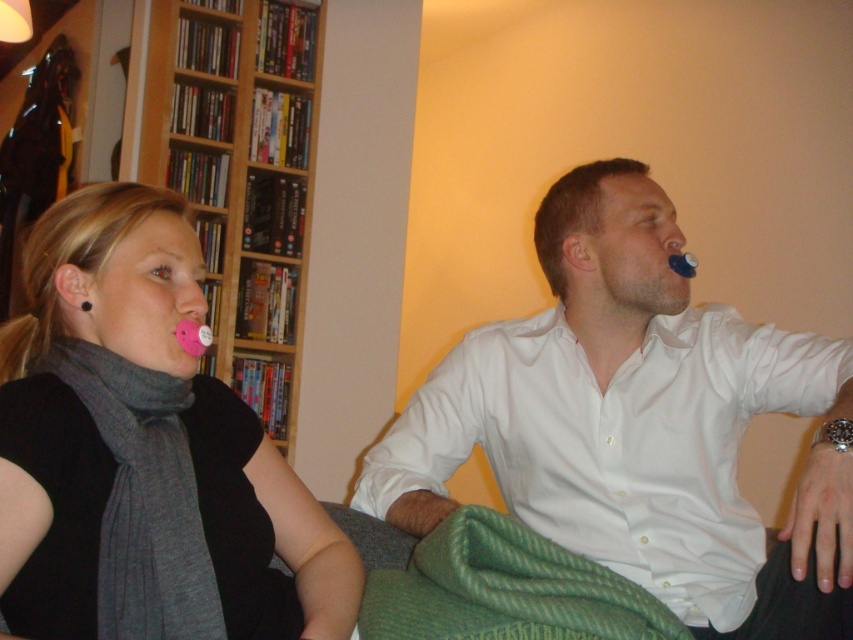
You are a tailor measuring the distance between two items in the image. The items are the white smooth shirt at upper right and the gray wool scarf at left. The tailor needs to know if the distance between them is at least 24 inches to ensure proper fabric length for a custom order. Can you confirm if the distance meets the requirement?

The distance between the white smooth shirt at upper right and the gray wool scarf at left is 23.82 inches, which is slightly less than the required 24 inches. Therefore, the distance does not meet the requirement.

You are designing a layout for a magazine article about the scene. You need to mention both the white smooth shirt at upper right and the gray wool scarf at left. Which one should be described as being higher up in the image?

The white smooth shirt at upper right is taller than the gray wool scarf at left, so it should be described as being higher up in the image.